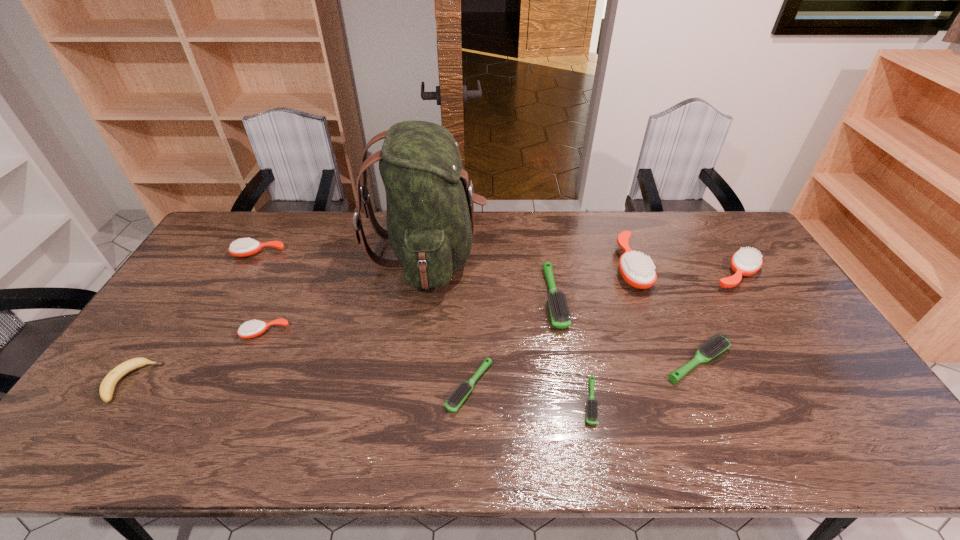
Identify the location of vacant area situated 0.100m on the front of the second biggest light hairbrush. (724, 421).

I want to click on vacant space positioned on the front of the nearest orange hairbrush, so [x=248, y=372].

This screenshot has height=540, width=960. What are the coordinates of `free space located 0.300m on the back of the leftmost light hairbrush` in the screenshot? It's located at (471, 284).

This screenshot has width=960, height=540. Find the location of `free region located on the back of the banana`. free region located on the back of the banana is located at coordinates (190, 295).

The height and width of the screenshot is (540, 960). Find the location of `vacant area situated on the back of the shortest hairbrush`. vacant area situated on the back of the shortest hairbrush is located at coordinates (577, 337).

Locate an element on the screen. backpack that is at the far edge is located at coordinates (430, 215).

This screenshot has height=540, width=960. I want to click on object that is at the near edge, so click(x=591, y=413).

What are the coordinates of `hairbrush that is at the left edge` in the screenshot? It's located at (244, 247).

Identify the location of banana situated at the left edge. (107, 387).

In order to click on object located in the right edge section of the desktop in this screenshot , I will do point(745,262).